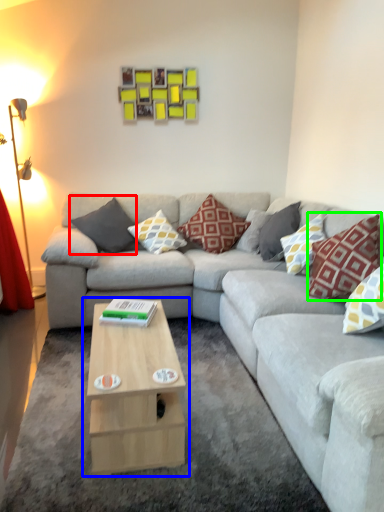
Question: Which object is the closest to the pillow (highlighted by a red box)? Choose among these: coffee table (highlighted by a blue box) or pillow (highlighted by a green box).

Choices:
 (A) coffee table
 (B) pillow

Answer: (A)